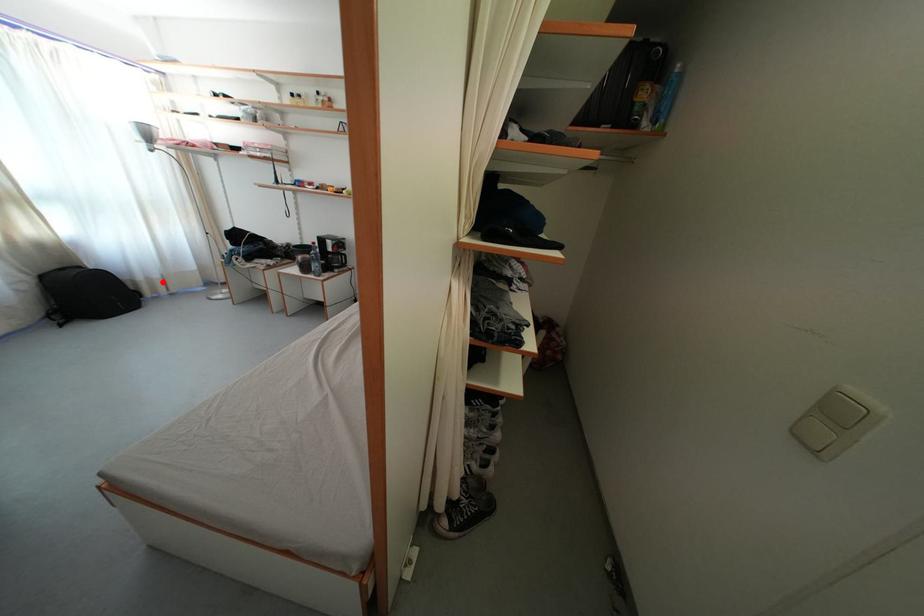
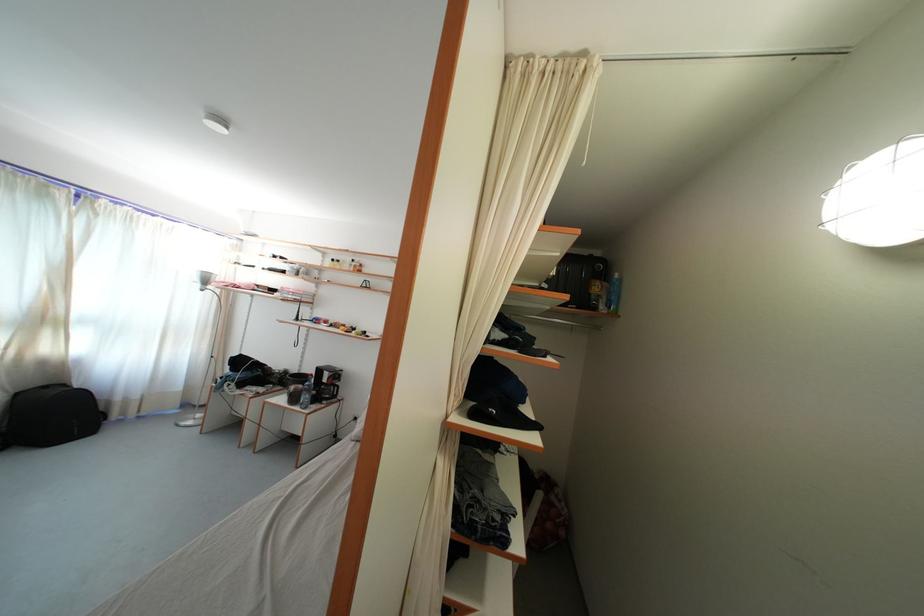
Find the pixel in the second image that matches the highlighted location in the first image.

(141, 403)